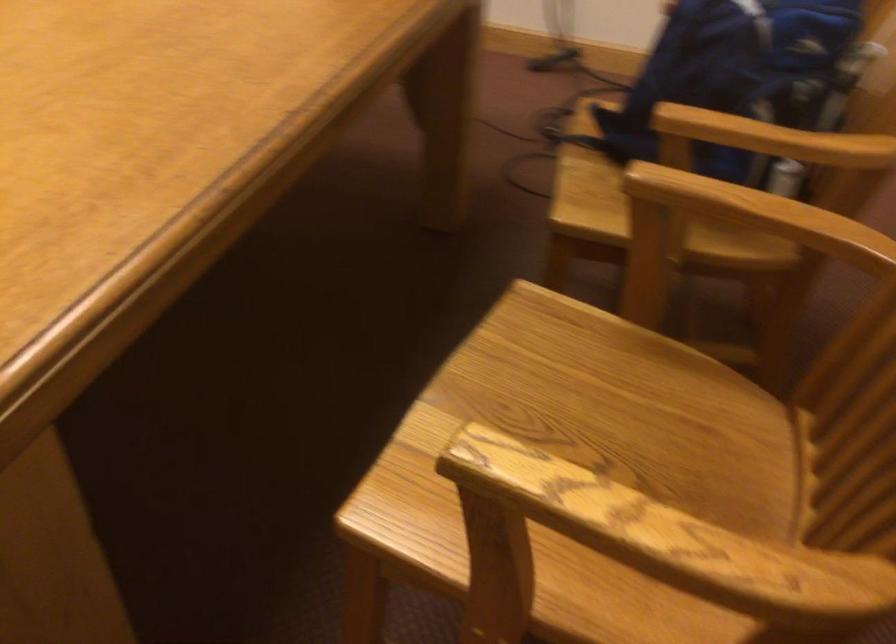
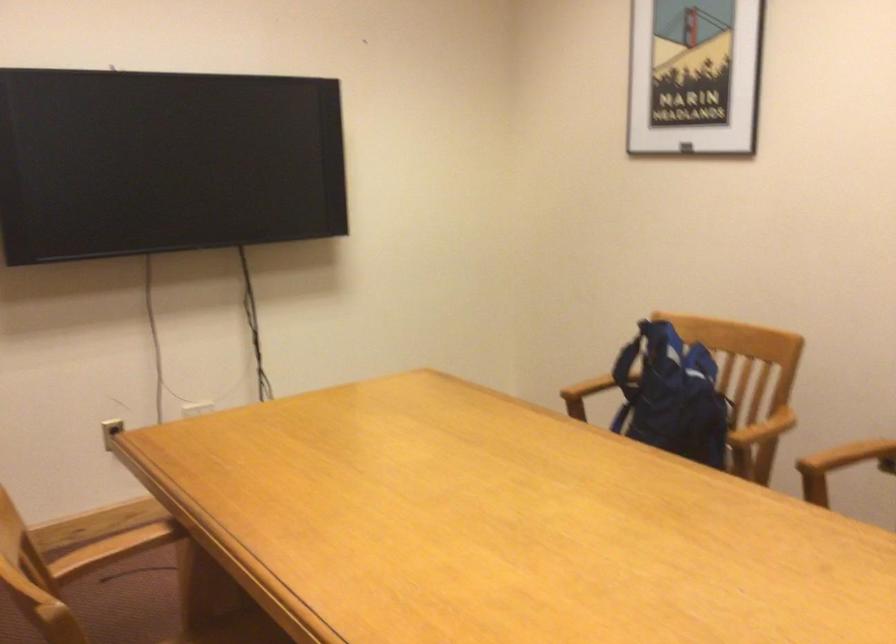
The point at (x=788, y=142) is marked in the first image. Where is the corresponding point in the second image?

(763, 428)